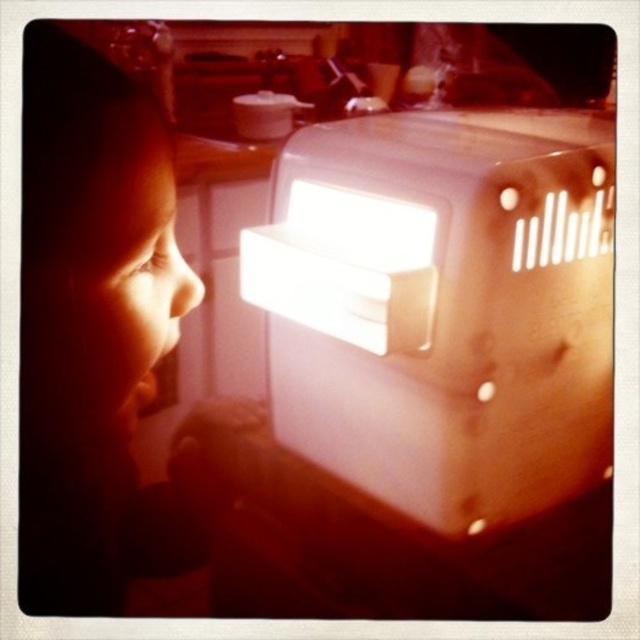
Does white plastic oven at center have a lesser width compared to matte skin child at left?

No, white plastic oven at center is not thinner than matte skin child at left.

Is white plastic oven at center wider than matte skin child at left?

Yes.

Based on the photo, who is more forward, (x=531, y=116) or (x=150, y=99)?

Point (x=150, y=99)

This screenshot has height=640, width=640. Find the location of `white plastic oven at center`. white plastic oven at center is located at coordinates (442, 307).